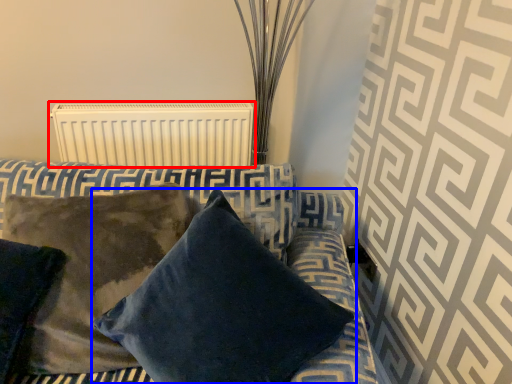
Question: Which object appears closest to the camera in this image, radiator (highlighted by a red box) or pillow (highlighted by a blue box)?

Choices:
 (A) radiator
 (B) pillow

Answer: (B)